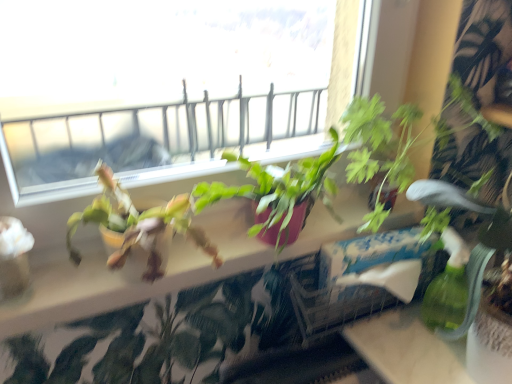
Question: Should I look upward or downward to see green leafy plant at right?

Choices:
 (A) down
 (B) up

Answer: (A)

Question: Is the depth of green leafy plant at right less than that of white cardboard box at center?

Choices:
 (A) yes
 (B) no

Answer: (A)

Question: Is green leafy plant at right further to the viewer compared to white cardboard box at center?

Choices:
 (A) yes
 (B) no

Answer: (B)

Question: Is green leafy plant at right bigger than white cardboard box at center?

Choices:
 (A) no
 (B) yes

Answer: (B)

Question: Considering the relative sizes of green leafy plant at right and white cardboard box at center in the image provided, is green leafy plant at right taller than white cardboard box at center?

Choices:
 (A) no
 (B) yes

Answer: (B)

Question: From a real-world perspective, is green leafy plant at right under white cardboard box at center?

Choices:
 (A) yes
 (B) no

Answer: (B)

Question: Is green leafy plant at right at the right side of white cardboard box at center?

Choices:
 (A) yes
 (B) no

Answer: (A)

Question: Considering the relative positions of white cardboard box at center and green leafy plant at right in the image provided, is white cardboard box at center in front of green leafy plant at right?

Choices:
 (A) yes
 (B) no

Answer: (B)

Question: Are white cardboard box at center and green leafy plant at right far apart?

Choices:
 (A) yes
 (B) no

Answer: (B)

Question: Considering the relative sizes of white cardboard box at center and green leafy plant at right in the image provided, is white cardboard box at center smaller than green leafy plant at right?

Choices:
 (A) no
 (B) yes

Answer: (B)

Question: Is white cardboard box at center wider than green leafy plant at right?

Choices:
 (A) no
 (B) yes

Answer: (A)

Question: From a real-world perspective, does white cardboard box at center stand above green leafy plant at right?

Choices:
 (A) no
 (B) yes

Answer: (A)

Question: Does white cardboard box at center have a greater height compared to green leafy plant at right?

Choices:
 (A) no
 (B) yes

Answer: (A)

Question: Is matte pink pot at center thinner than green leafy plant at right?

Choices:
 (A) yes
 (B) no

Answer: (A)